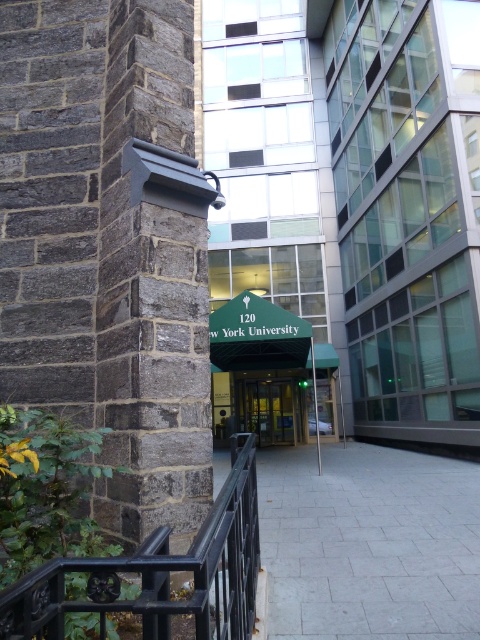
You are a delivery person trying to find the entrance to the building. You see the black wrought iron at center and the green fabric entrance at center. Which one is closer to you?

The black wrought iron at center is closer to you because it is in front of the green fabric entrance at center.

You are a city planner reviewing this urban design. The dark gray stone pillar at left and the black wrought iron at center are both part of the pathway structure. Which of these two objects has a greater width?

The dark gray stone pillar at left has a greater width than the black wrought iron at center according to the description.

You are a delivery person trying to determine the best route to the entrance. You see a dark gray stone pillar at left and a green fabric entrance at center. Which object is larger and could help you identify the entrance?

The dark gray stone pillar at left is bigger than the green fabric entrance at center, so the entrance is the smaller object between them.